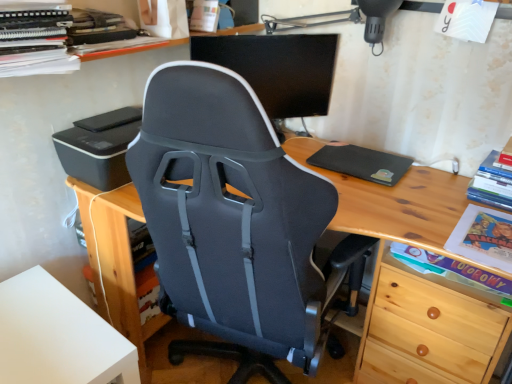
This screenshot has height=384, width=512. I want to click on free space above white matte table at lower left (from a real-world perspective), so click(42, 324).